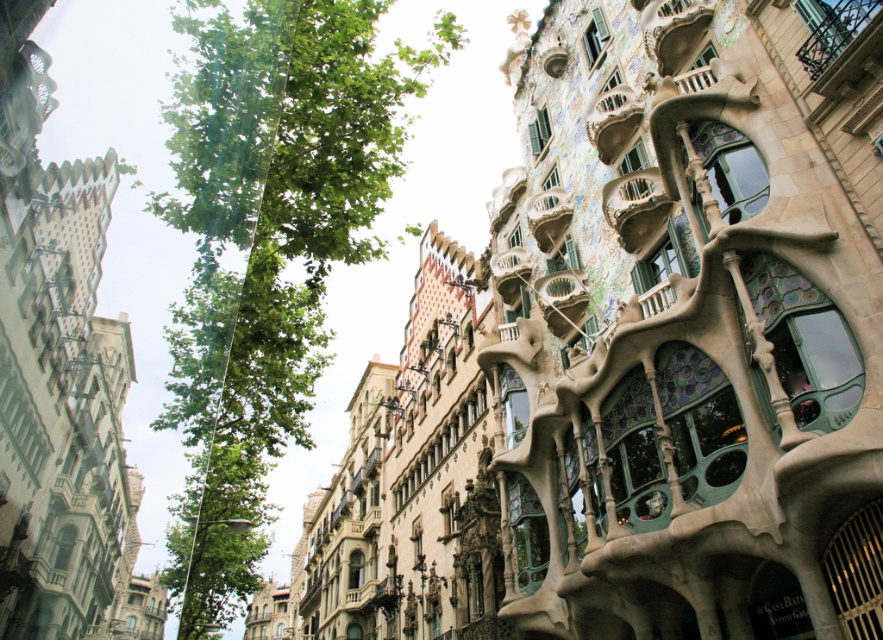
You are standing at the point with coordinates (635, 205) in the image. What architectural feature can you see at that exact location?

At point (635, 205) lies stained glass balcony at upper right.

You are a drone operator tasked with capturing aerial footage of the green leafy tree at center and the multicolored mosaic balcony at upper center. Your drone has a maximum flight range of 70 meters. Can the drone capture both locations in a single flight without needing to recharge?

The green leafy tree at center and multicolored mosaic balcony at upper center are 69.99 meters apart from each other. Since the distance is just under the drone maximum flight range of 70 meters, the drone can capture both locations in a single flight without needing to recharge.